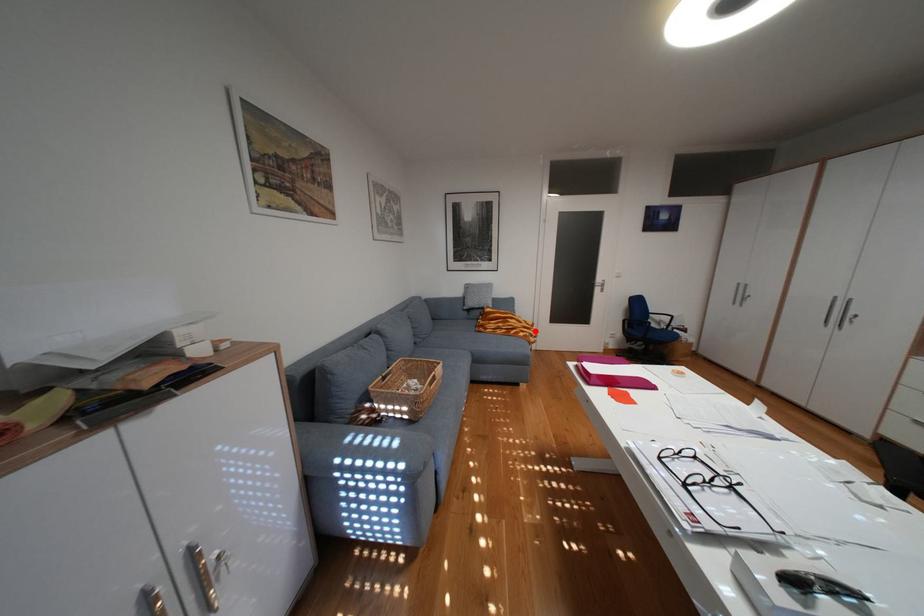
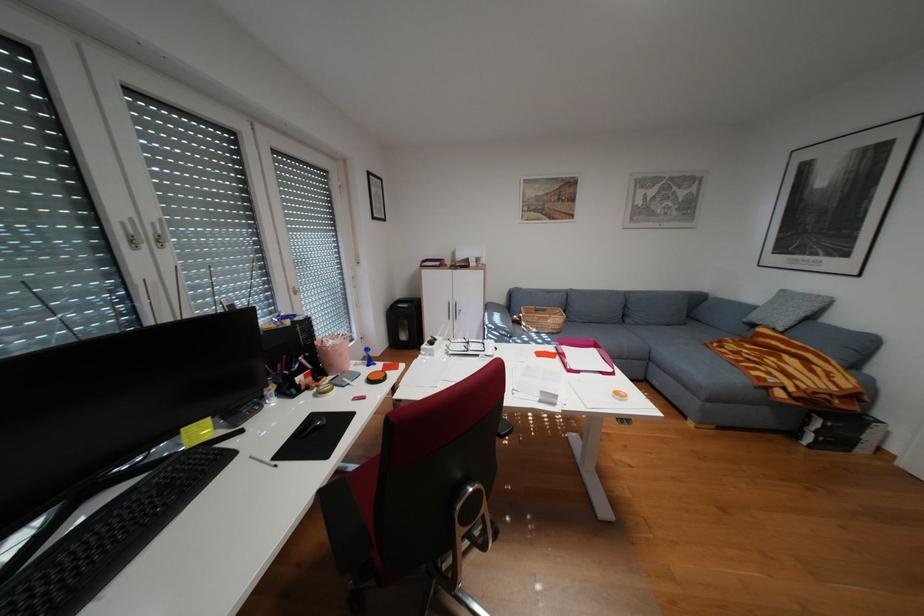
Locate, in the second image, the point that corresponds to the highlighted location in the first image.

(782, 373)